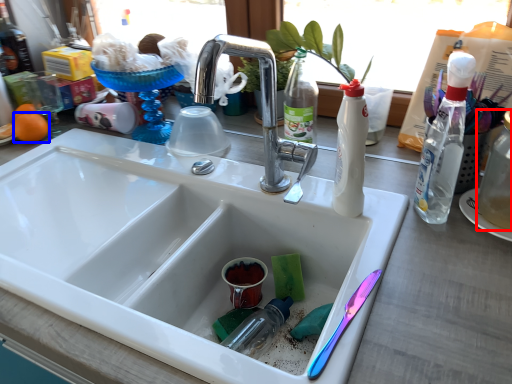
Question: Which object appears farthest to the camera in this image, bottle (highlighted by a red box) or orange (highlighted by a blue box)?

Choices:
 (A) bottle
 (B) orange

Answer: (B)